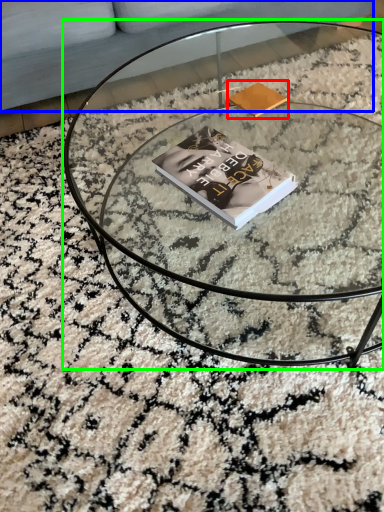
Question: Considering the real-world distances, which object is farthest from paperback book (highlighted by a red box)? couch (highlighted by a blue box) or coffee table (highlighted by a green box)?

Choices:
 (A) couch
 (B) coffee table

Answer: (A)